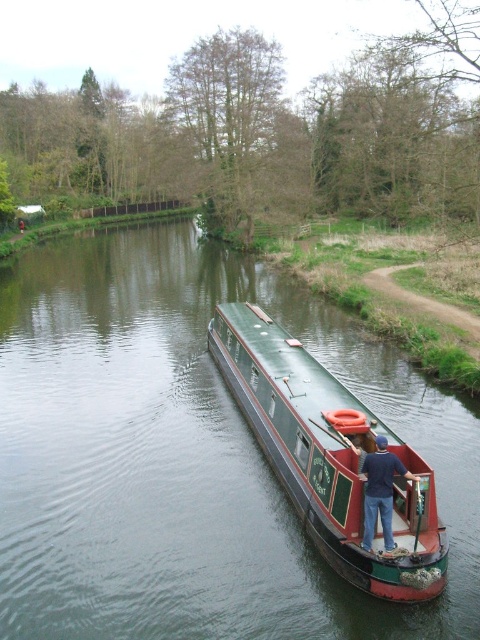
Question: Does green polished wood boat at center have a greater width compared to green painted wood boat at center?

Choices:
 (A) no
 (B) yes

Answer: (B)

Question: Is green painted wood boat at center thinner than dark blue shirt at center?

Choices:
 (A) yes
 (B) no

Answer: (B)

Question: Among these objects, which one is nearest to the camera?

Choices:
 (A) green painted wood boat at center
 (B) dark blue shirt at center

Answer: (A)

Question: Which point appears closest to the camera in this image?

Choices:
 (A) (264, 403)
 (B) (35, 424)
 (C) (385, 492)

Answer: (C)

Question: Is the position of green polished wood boat at center less distant than that of green painted wood boat at center?

Choices:
 (A) no
 (B) yes

Answer: (B)

Question: Which point appears closest to the camera in this image?

Choices:
 (A) (66, 538)
 (B) (394, 468)

Answer: (B)